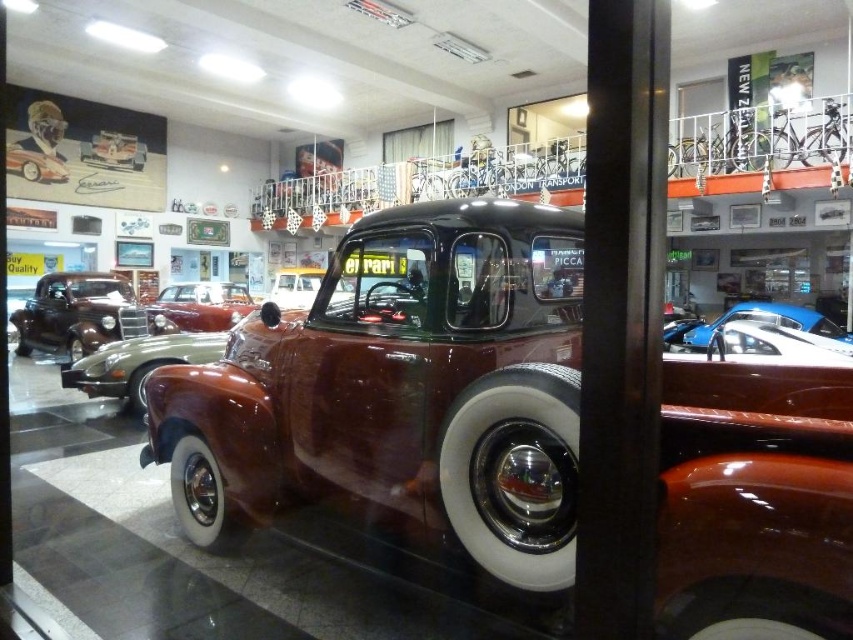
Question: Estimate the real-world distances between objects in this image. Which object is closer to the shiny silver car at center?

Choices:
 (A) blue glossy car at right
 (B) shiny silver car at upper left

Answer: (B)

Question: Is the position of blue glossy car at right more distant than that of shiny silver car at upper left?

Choices:
 (A) yes
 (B) no

Answer: (B)

Question: Can you confirm if shiny silver car at center is positioned above shiny silver car at upper left?

Choices:
 (A) no
 (B) yes

Answer: (A)

Question: Is shiny maroon car at center below shiny silver car at upper left?

Choices:
 (A) yes
 (B) no

Answer: (A)

Question: Which of these objects is positioned closest to the blue glossy car at right?

Choices:
 (A) shiny maroon car at center
 (B) shiny brown car at left

Answer: (A)

Question: Estimate the real-world distances between objects in this image. Which object is farther from the shiny silver car at upper left?

Choices:
 (A) shiny silver car at center
 (B) shiny brown car at left

Answer: (A)